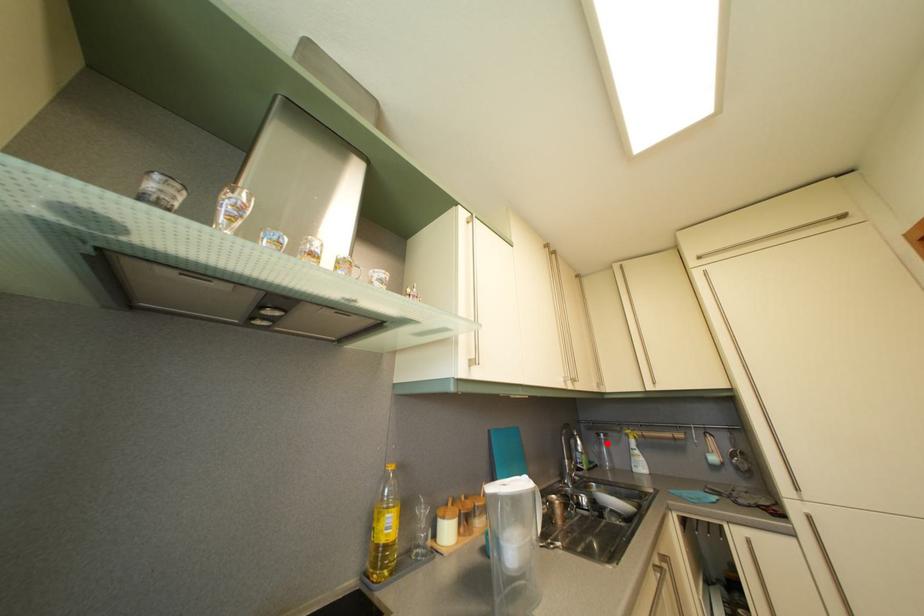
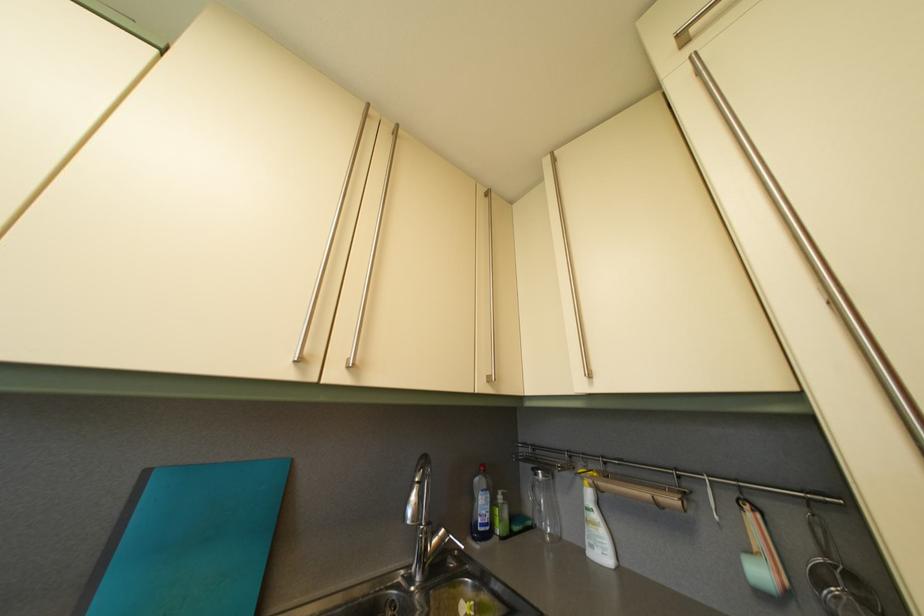
Where in the second image is the point corresponding to the highlighted location from the first image?

(544, 482)